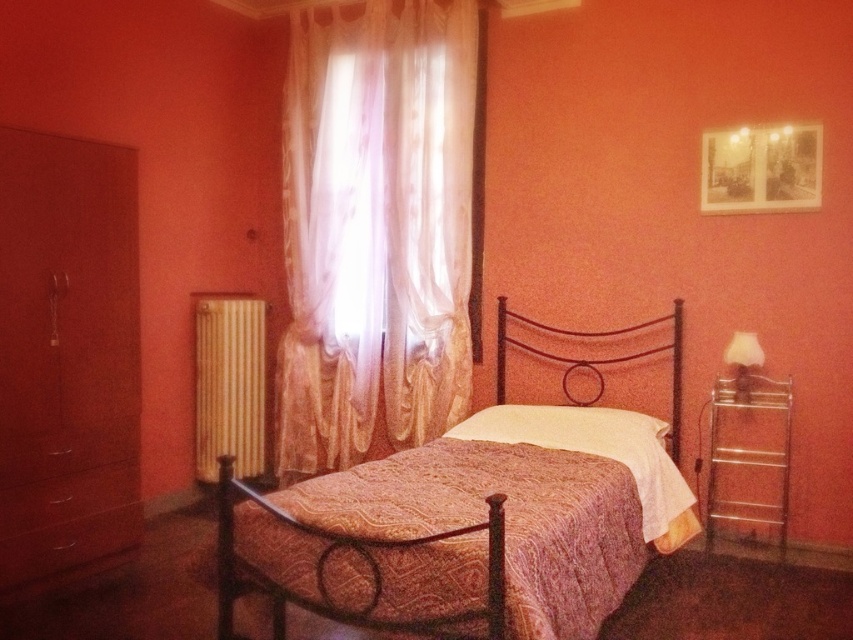
The width and height of the screenshot is (853, 640). What do you see at coordinates (67, 353) in the screenshot?
I see `matte wood dresser at left` at bounding box center [67, 353].

Find the location of `matte wood dresser at left`. matte wood dresser at left is located at coordinates (67, 353).

Between point (70, 486) and point (206, 388), which one is positioned in front?

Point (70, 486) is more forward.

Identify the location of matte brown drawer at lower left. The width and height of the screenshot is (853, 640). (67, 522).

Is metallic bed at center above matte wood dresser at left?

No.

Is metallic bed at center below matte wood dresser at left?

Correct, metallic bed at center is located below matte wood dresser at left.

Does point (321, 554) come closer to viewer compared to point (126, 440)?

Yes, point (321, 554) is closer to viewer.

Find the location of `metallic bed at center`. metallic bed at center is located at coordinates (445, 544).